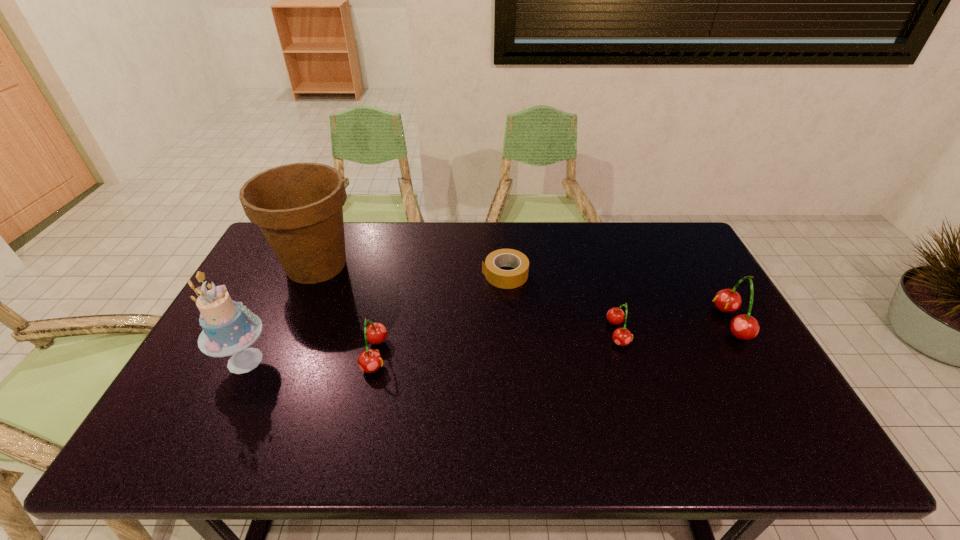
The height and width of the screenshot is (540, 960). Find the location of `object that is the closest to the cake`. object that is the closest to the cake is located at coordinates 299,207.

You are a GUI agent. You are given a task and a screenshot of the screen. Output one action in this format:
    pyautogui.click(x=<x>, y=<y>)
    Task: Click on the closest object relative to the shortest cherry
    Image resolution: width=960 pixels, height=540 pixels.
    Given the screenshot: What is the action you would take?
    pyautogui.click(x=506, y=279)

Find the location of a particular element. The image size is (960, 540). cherry object that ranks as the closest to the rightmost cherry is located at coordinates (621, 336).

Identify which cherry is the second nearest to the second cherry from right to left. Please provide its 2D coordinates. Your answer should be formatted as a tuple, i.e. [(x, y)], where the tuple contains the x and y coordinates of a point satisfying the conditions above.

[(370, 360)]